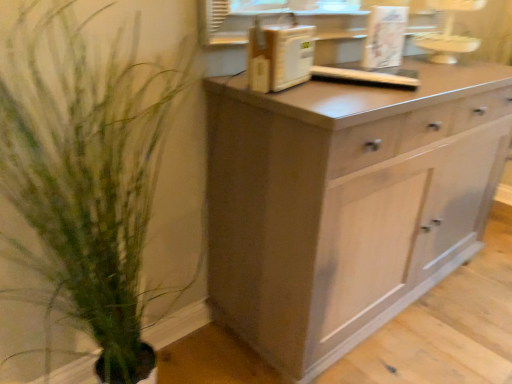
Question: From the image's perspective, does green leafy plant at left appear lower than white plastic microwave at upper center?

Choices:
 (A) no
 (B) yes

Answer: (B)

Question: Considering the relative positions of green leafy plant at left and white plastic microwave at upper center in the image provided, is green leafy plant at left to the right of white plastic microwave at upper center from the viewer's perspective?

Choices:
 (A) yes
 (B) no

Answer: (B)

Question: Is the surface of green leafy plant at left in direct contact with white plastic microwave at upper center?

Choices:
 (A) no
 (B) yes

Answer: (A)

Question: Is green leafy plant at left completely or partially outside of white plastic microwave at upper center?

Choices:
 (A) yes
 (B) no

Answer: (A)

Question: Is green leafy plant at left to the left of white plastic microwave at upper center from the viewer's perspective?

Choices:
 (A) no
 (B) yes

Answer: (B)

Question: Is white plastic microwave at upper center at the back of green leafy plant at left?

Choices:
 (A) yes
 (B) no

Answer: (B)

Question: Does white plastic microwave at upper center have a greater width compared to green leafy plant at left?

Choices:
 (A) no
 (B) yes

Answer: (A)

Question: Is white plastic microwave at upper center far away from green leafy plant at left?

Choices:
 (A) no
 (B) yes

Answer: (A)

Question: Can you confirm if white plastic microwave at upper center is shorter than green leafy plant at left?

Choices:
 (A) no
 (B) yes

Answer: (B)

Question: From the image's perspective, is white plastic microwave at upper center below green leafy plant at left?

Choices:
 (A) no
 (B) yes

Answer: (A)

Question: From a real-world perspective, is white plastic microwave at upper center located beneath green leafy plant at left?

Choices:
 (A) no
 (B) yes

Answer: (A)

Question: Is green leafy plant at left inside white plastic microwave at upper center?

Choices:
 (A) no
 (B) yes

Answer: (A)

Question: Is matte gray cabinet at center next to white plastic microwave at upper center?

Choices:
 (A) no
 (B) yes

Answer: (A)